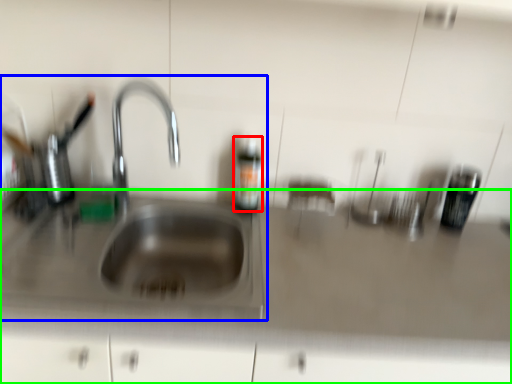
Question: Which object is the closest to the bottle (highlighted by a red box)? Choose among these: sink (highlighted by a blue box) or counter top (highlighted by a green box).

Choices:
 (A) sink
 (B) counter top

Answer: (A)